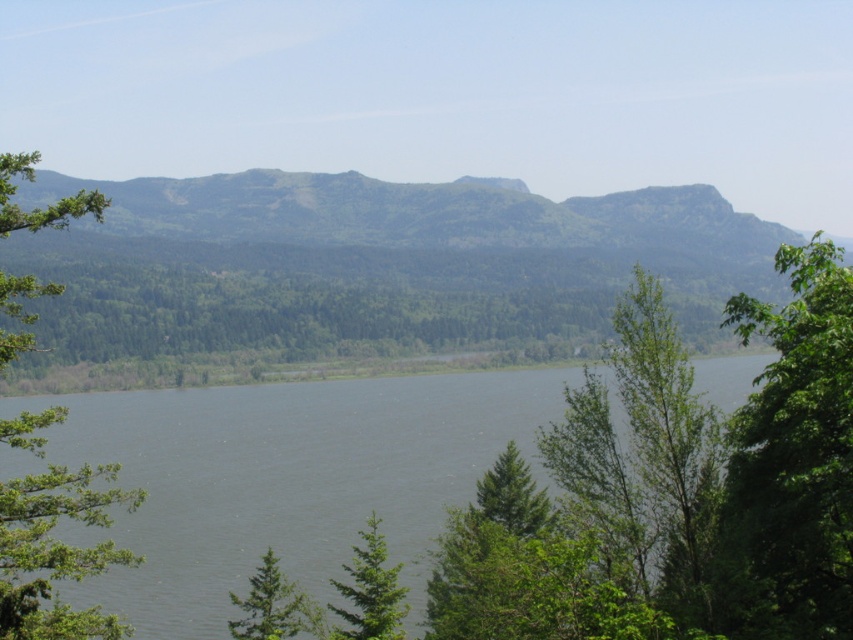
Consider the image. Does green textured mountain at center have a larger size compared to green leafy tree at center-right?

Yes.

Consider the image. Can you confirm if green textured mountain at center is positioned below green leafy tree at center-right?

No.

Is point (155, 362) in front of point (653, 413)?

That is False.

The image size is (853, 640). I want to click on green textured mountain at center, so click(x=364, y=273).

Measure the distance between green textured mountain at center and green leafy tree at right.

347.17 meters

Can you confirm if green textured mountain at center is taller than green leafy tree at right?

Correct, green textured mountain at center is much taller as green leafy tree at right.

Who is more distant from viewer, (x=601, y=214) or (x=744, y=572)?

The point (x=601, y=214) is behind.

Identify the location of green textured mountain at center. (364, 273).

Does green leafy tree at right come in front of green leafy tree at center-right?

That is True.

Can you confirm if green leafy tree at right is positioned to the right of green leafy tree at center-right?

Incorrect, green leafy tree at right is not on the right side of green leafy tree at center-right.

Which is behind, point (744, 416) or point (695, 417)?

Positioned behind is point (695, 417).

Image resolution: width=853 pixels, height=640 pixels. Identify the location of green leafy tree at right. tap(792, 460).